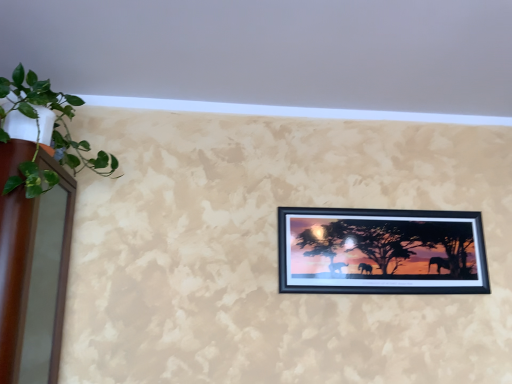
Question: From the image's perspective, is beige textured wall at upper center on top of green leafy plant at left?

Choices:
 (A) no
 (B) yes

Answer: (B)

Question: Is beige textured wall at upper center in contact with green leafy plant at left?

Choices:
 (A) yes
 (B) no

Answer: (B)

Question: Is green leafy plant at left at the back of beige textured wall at upper center?

Choices:
 (A) no
 (B) yes

Answer: (A)

Question: Considering the relative sizes of beige textured wall at upper center and green leafy plant at left in the image provided, is beige textured wall at upper center smaller than green leafy plant at left?

Choices:
 (A) no
 (B) yes

Answer: (A)

Question: Does beige textured wall at upper center have a greater width compared to green leafy plant at left?

Choices:
 (A) no
 (B) yes

Answer: (B)

Question: Looking at the image, does beige textured wall at upper center seem bigger or smaller compared to green leafy plant at left?

Choices:
 (A) small
 (B) big

Answer: (B)

Question: Would you say beige textured wall at upper center is to the left or to the right of green leafy plant at left in the picture?

Choices:
 (A) left
 (B) right

Answer: (B)

Question: Considering the positions of point (287, 57) and point (90, 160), is point (287, 57) closer or farther from the camera than point (90, 160)?

Choices:
 (A) closer
 (B) farther

Answer: (A)

Question: From a real-world perspective, is beige textured wall at upper center above or below green leafy plant at left?

Choices:
 (A) above
 (B) below

Answer: (A)

Question: Considering the positions of beige textured wall at upper center and black matte picture frame at center in the image, is beige textured wall at upper center taller or shorter than black matte picture frame at center?

Choices:
 (A) short
 (B) tall

Answer: (A)

Question: From a real-world perspective, relative to black matte picture frame at center, is beige textured wall at upper center vertically above or below?

Choices:
 (A) below
 (B) above

Answer: (B)

Question: Looking at the image, does beige textured wall at upper center seem bigger or smaller compared to black matte picture frame at center?

Choices:
 (A) small
 (B) big

Answer: (B)

Question: Considering the relative positions of beige textured wall at upper center and black matte picture frame at center in the image provided, is beige textured wall at upper center to the left or to the right of black matte picture frame at center?

Choices:
 (A) left
 (B) right

Answer: (A)

Question: Considering the positions of point (347, 213) and point (103, 172), is point (347, 213) closer or farther from the camera than point (103, 172)?

Choices:
 (A) closer
 (B) farther

Answer: (B)

Question: Is black matte picture frame at center spatially inside green leafy plant at left, or outside of it?

Choices:
 (A) inside
 (B) outside

Answer: (B)